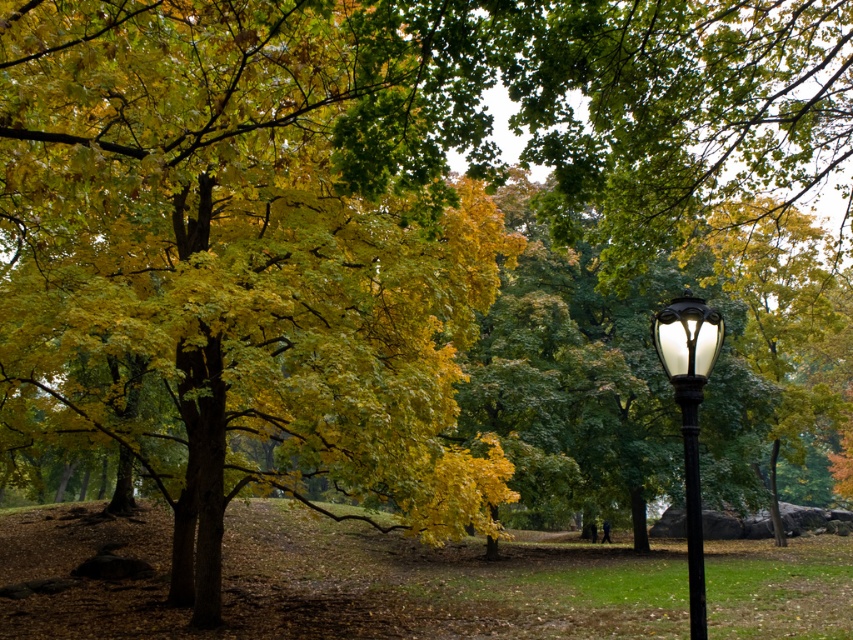
Question: Where is black metal lamp post at right located in relation to black polished metal pole at right in the image?

Choices:
 (A) above
 (B) below

Answer: (A)

Question: Is black metal lamp post at right to the right of black polished metal pole at right from the viewer's perspective?

Choices:
 (A) yes
 (B) no

Answer: (A)

Question: Does black metal lamp post at right have a greater width compared to black polished metal pole at right?

Choices:
 (A) no
 (B) yes

Answer: (B)

Question: Among these objects, which one is farthest from the camera?

Choices:
 (A) black metal lamp post at right
 (B) black polished metal pole at right

Answer: (A)

Question: Which point is closer to the camera?

Choices:
 (A) (700, 608)
 (B) (706, 308)

Answer: (A)